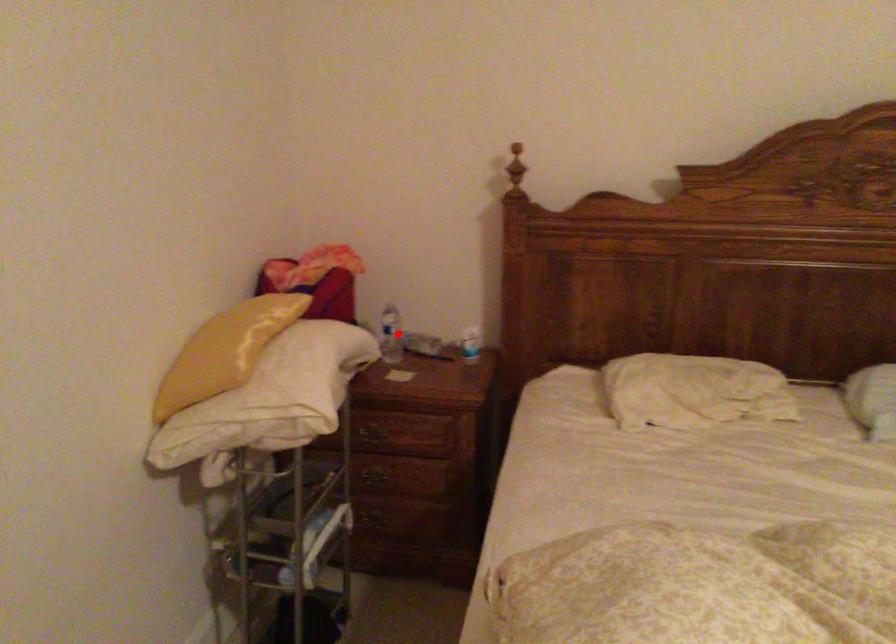
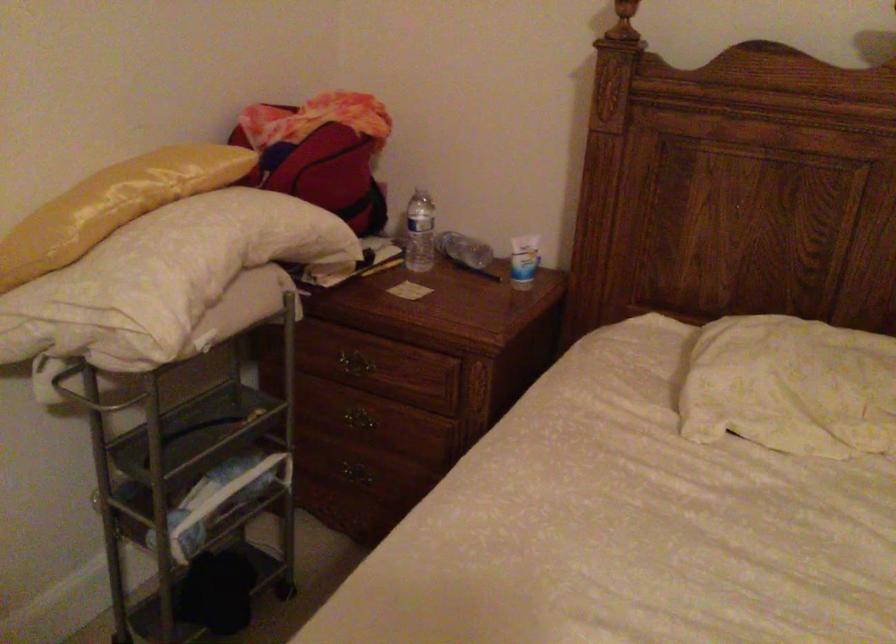
Locate, in the second image, the point that corresponds to the highlighted location in the first image.

(419, 232)